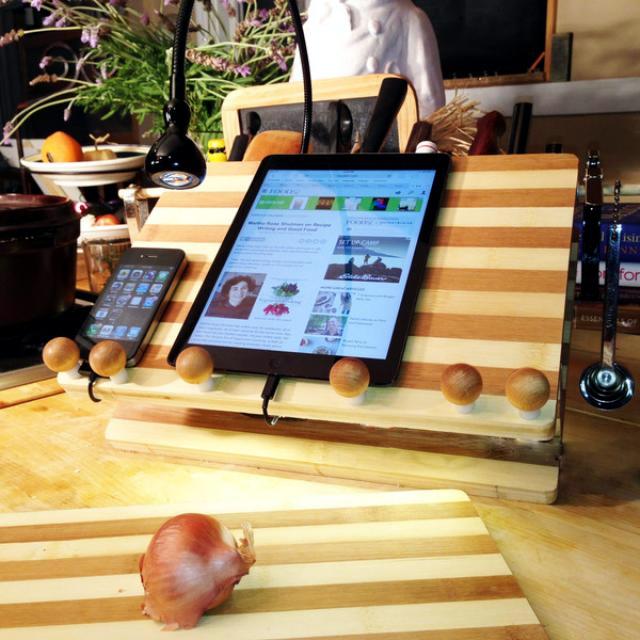
In order to click on lamp in this screenshot , I will do `click(173, 173)`.